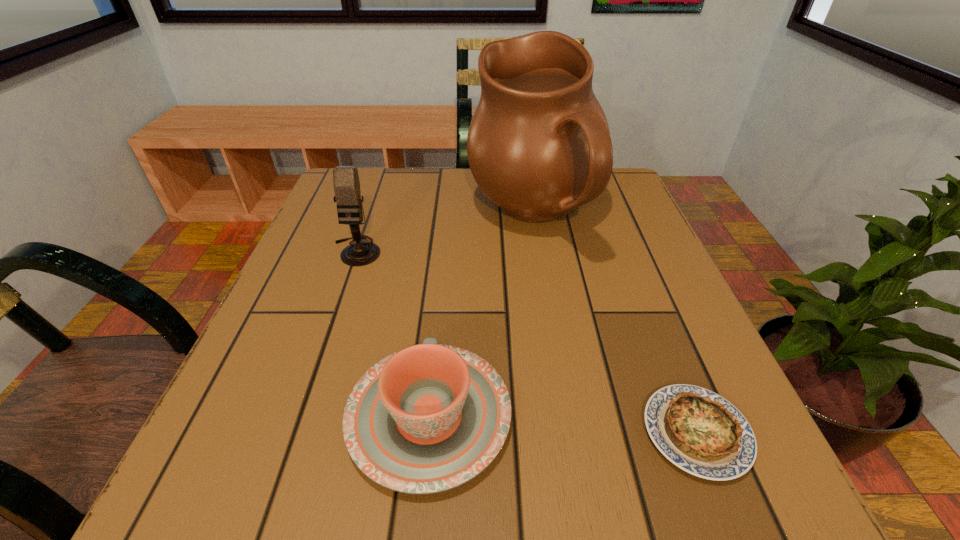
Where is `free spot located on the handle side of the second shortest object`? Image resolution: width=960 pixels, height=540 pixels. free spot located on the handle side of the second shortest object is located at coordinates (443, 279).

Identify the location of blank space located on the handle side of the second shortest object. Image resolution: width=960 pixels, height=540 pixels. (443, 279).

Image resolution: width=960 pixels, height=540 pixels. I want to click on blank space located on the left of the shortest object, so click(x=600, y=433).

Locate an element on the screen. This screenshot has height=540, width=960. object at the far edge is located at coordinates (538, 146).

In order to click on chinaware that is positioned at the near edge in this screenshot , I will do `click(426, 419)`.

This screenshot has height=540, width=960. Identify the location of quiche situated at the near edge. (699, 431).

Where is `object at the left edge`? The width and height of the screenshot is (960, 540). object at the left edge is located at coordinates (346, 182).

This screenshot has width=960, height=540. In order to click on cream pitcher positioned at the right edge in this screenshot , I will do `click(538, 146)`.

This screenshot has height=540, width=960. In order to click on quiche that is at the right edge in this screenshot , I will do `click(699, 431)`.

This screenshot has height=540, width=960. Find the location of `object situated at the far right corner`. object situated at the far right corner is located at coordinates pos(538,146).